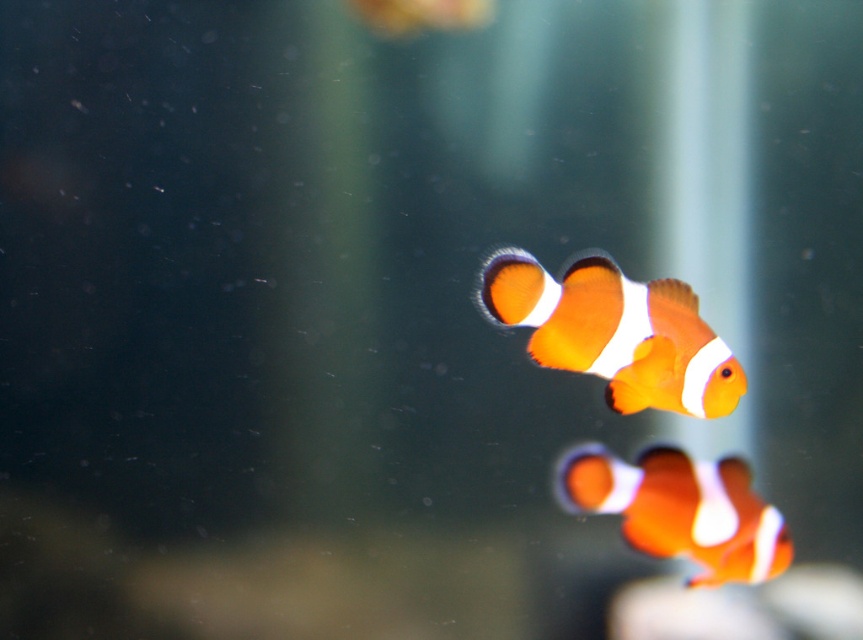
Question: Is orange matte clownfish at center smaller than orange matte clownfish at lower right?

Choices:
 (A) no
 (B) yes

Answer: (B)

Question: Does orange matte clownfish at center appear over orange matte clownfish at lower right?

Choices:
 (A) no
 (B) yes

Answer: (B)

Question: Is the position of orange matte clownfish at center more distant than that of orange matte clownfish at lower right?

Choices:
 (A) no
 (B) yes

Answer: (A)

Question: Which point is farther to the camera?

Choices:
 (A) (567, 506)
 (B) (734, 358)

Answer: (A)